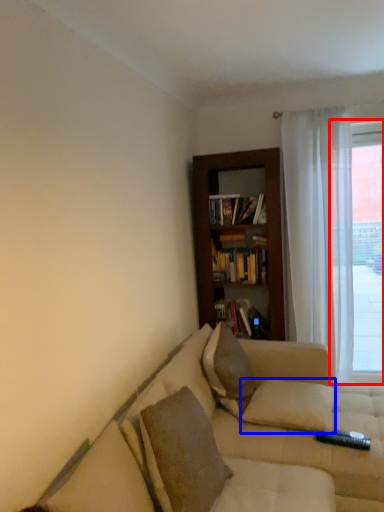
Question: Among these objects, which one is nearest to the camera, window (highlighted by a red box) or pillow (highlighted by a blue box)?

Choices:
 (A) window
 (B) pillow

Answer: (B)